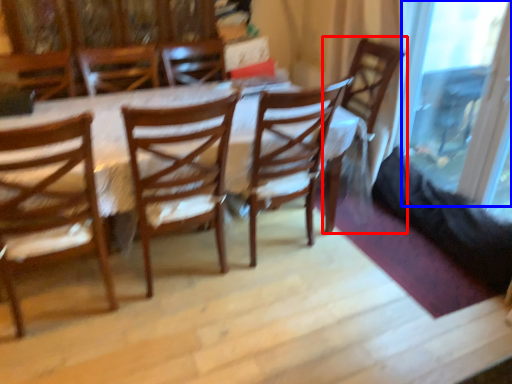
Question: Which object appears closest to the camera in this image, chair (highlighted by a red box) or glass door (highlighted by a blue box)?

Choices:
 (A) chair
 (B) glass door

Answer: (B)